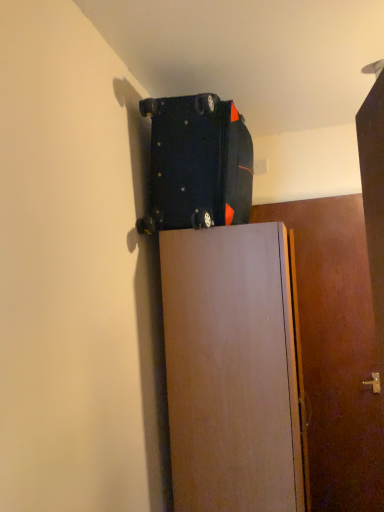
What do you see at coordinates (197, 164) in the screenshot?
I see `matte black suitcase at upper corner` at bounding box center [197, 164].

You are a GUI agent. You are given a task and a screenshot of the screen. Output one action in this format:
    pyautogui.click(x=<x>, y=<y>)
    Task: Click on the matte black suitcase at upper corner
    Image resolution: width=384 pixels, height=512 pixels.
    Given the screenshot: What is the action you would take?
    pyautogui.click(x=197, y=164)

Identify the location of matte black suitcase at upper corner. (197, 164).